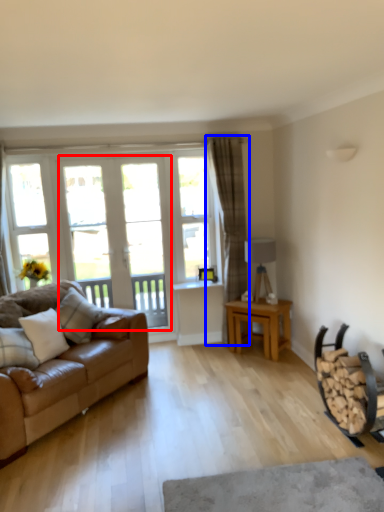
Question: Which point is closer to the camera, screen door (highlighted by a red box) or curtain (highlighted by a blue box)?

Choices:
 (A) screen door
 (B) curtain

Answer: (B)